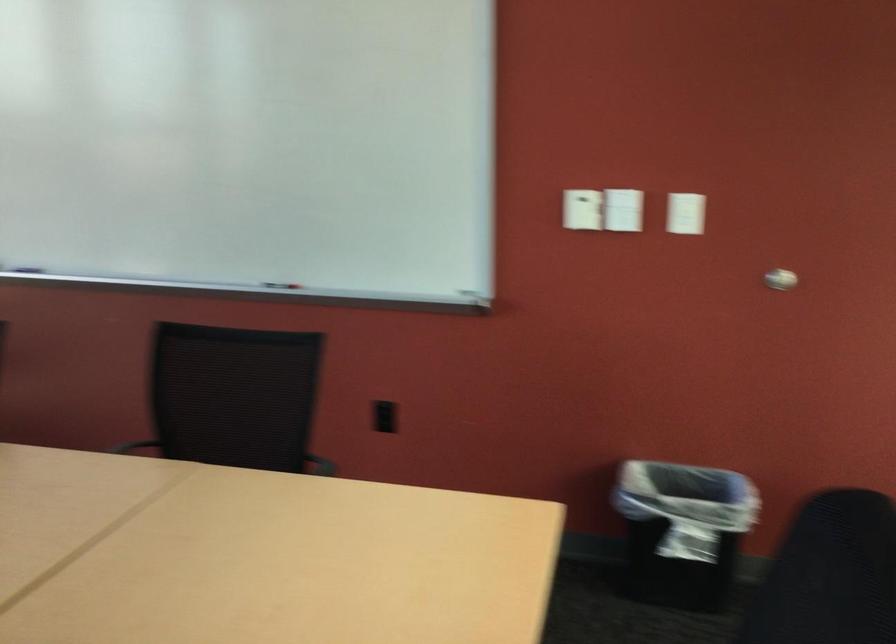
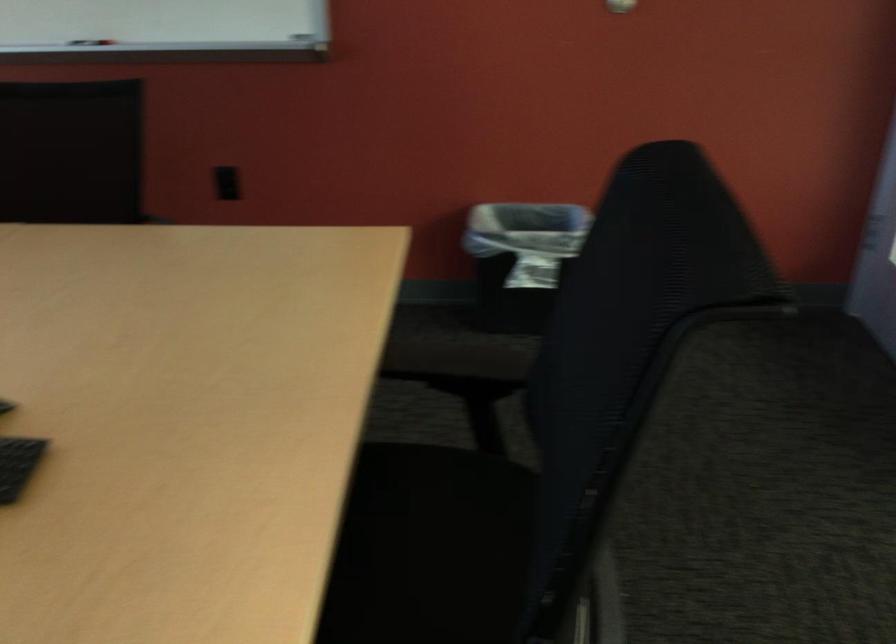
Find the pixel in the second image that matches the point at 395,427 in the first image.

(227, 183)